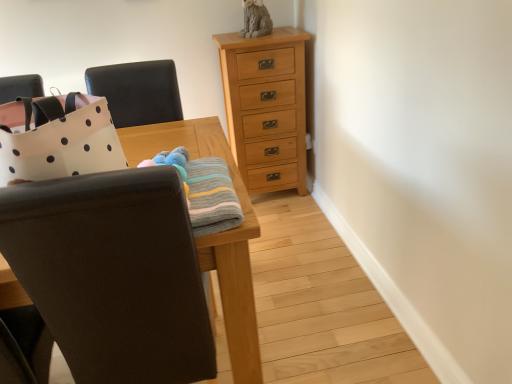
Measure the distance between point (x=151, y=273) and camera.

Point (x=151, y=273) and camera are 1.01 meters apart from each other.

What do you see at coordinates (113, 274) in the screenshot? This screenshot has width=512, height=384. I see `matte black chair at left, which is the first chair from bottom to top` at bounding box center [113, 274].

Consider the image. Measure the distance between black leather chair at upper left, which appears as the 1th chair when viewed from the top, and camera.

The depth of black leather chair at upper left, which appears as the 1th chair when viewed from the top, is 6.14 feet.

Describe the element at coordinates (266, 107) in the screenshot. This screenshot has width=512, height=384. I see `natural wood chest of drawers at upper center` at that location.

Identify the location of matte black chair at left, which is the first chair from bottom to top. Image resolution: width=512 pixels, height=384 pixels. (113, 274).

Is matte black chair at left, the 2th chair viewed from the top, looking in the opposite direction of black leather chair at upper left, which appears as the 1th chair when viewed from the top?

That's not correct — matte black chair at left, the 2th chair viewed from the top, is not looking away from black leather chair at upper left, which appears as the 1th chair when viewed from the top.

Image resolution: width=512 pixels, height=384 pixels. Identify the location of chair below the black leather chair at upper left, which appears as the 1th chair when viewed from the top (from the image's perspective). (113, 274).

Does matte black chair at left, the 2th chair viewed from the top, have a greater width compared to black leather chair at upper left, the 2th chair ordered from the bottom?

Indeed, matte black chair at left, the 2th chair viewed from the top, has a greater width compared to black leather chair at upper left, the 2th chair ordered from the bottom.

Is matte black chair at left, which is the first chair from bottom to top, closer to the viewer compared to black leather chair at upper left, which appears as the 1th chair when viewed from the top?

Yes, it is.

Is matte black chair at left, the 2th chair viewed from the top, bigger than knitted woolen blanket at center?

Correct, matte black chair at left, the 2th chair viewed from the top, is larger in size than knitted woolen blanket at center.

Is matte black chair at left, the 2th chair viewed from the top, facing away from knitted woolen blanket at center?

No, matte black chair at left, the 2th chair viewed from the top,'s orientation is not away from knitted woolen blanket at center.

From the image's perspective, is matte black chair at left, which is the first chair from bottom to top, under knitted woolen blanket at center?

Indeed, from the image's perspective, matte black chair at left, which is the first chair from bottom to top, is shown beneath knitted woolen blanket at center.

Image resolution: width=512 pixels, height=384 pixels. In order to click on blanket above the matte black chair at left, the 2th chair viewed from the top (from a real-world perspective) in this screenshot , I will do `click(212, 197)`.

Locate an element on the screen. The image size is (512, 384). chest of drawers above the black leather chair at upper left, the 2th chair ordered from the bottom (from the image's perspective) is located at coordinates (266, 107).

Would you say black leather chair at upper left, the 2th chair ordered from the bottom, is to the left or to the right of natural wood chest of drawers at upper center in the picture?

From the image, it's evident that black leather chair at upper left, the 2th chair ordered from the bottom, is to the left of natural wood chest of drawers at upper center.

From a real-world perspective, does black leather chair at upper left, which appears as the 1th chair when viewed from the top, sit lower than natural wood chest of drawers at upper center?

Incorrect, from a real-world perspective, black leather chair at upper left, which appears as the 1th chair when viewed from the top, is higher than natural wood chest of drawers at upper center.

Does black leather chair at upper left, the 2th chair ordered from the bottom, have a lesser height compared to natural wood chest of drawers at upper center?

Yes.

From a real-world perspective, who is located lower, natural wood chest of drawers at upper center or knitted woolen blanket at center?

natural wood chest of drawers at upper center, from a real-world perspective.

How different are the orientations of natural wood chest of drawers at upper center and knitted woolen blanket at center in degrees?

natural wood chest of drawers at upper center and knitted woolen blanket at center are facing 179 degrees away from each other.

Is point (254, 145) closer or farther from the camera than point (194, 212)?

Point (254, 145) is farther from the camera than point (194, 212).

Is natural wood chest of drawers at upper center outside of knitted woolen blanket at center?

Yes, natural wood chest of drawers at upper center is located beyond the bounds of knitted woolen blanket at center.

How many degrees apart are the facing directions of black leather chair at upper left, which appears as the 1th chair when viewed from the top, and matte black chair at left, the 2th chair viewed from the top?

The facing directions of black leather chair at upper left, which appears as the 1th chair when viewed from the top, and matte black chair at left, the 2th chair viewed from the top, are 178 degrees apart.

Which is less distant, (x=88, y=81) or (x=75, y=271)?

Point (x=88, y=81) is farther from the camera than point (x=75, y=271).

Which is correct: black leather chair at upper left, which appears as the 1th chair when viewed from the top, is inside matte black chair at left, which is the first chair from bottom to top, or outside of it?

black leather chair at upper left, which appears as the 1th chair when viewed from the top, cannot be found inside matte black chair at left, which is the first chair from bottom to top.

Which object is closer to the camera, black leather chair at upper left, the 2th chair ordered from the bottom, or matte black chair at left, the 2th chair viewed from the top?

matte black chair at left, the 2th chair viewed from the top, is more forward.

Does point (255, 58) lie in front of point (32, 216)?

That is False.

Are natural wood chest of drawers at upper center and matte black chair at left, the 2th chair viewed from the top, located far from each other?

Indeed, natural wood chest of drawers at upper center is not near matte black chair at left, the 2th chair viewed from the top.

Does natural wood chest of drawers at upper center appear on the left side of matte black chair at left, the 2th chair viewed from the top?

Incorrect, natural wood chest of drawers at upper center is not on the left side of matte black chair at left, the 2th chair viewed from the top.

In the image, there is a knitted woolen blanket at center. Where is `chair above it (from the image's perspective)`? This screenshot has height=384, width=512. chair above it (from the image's perspective) is located at coordinates (137, 92).

Between knitted woolen blanket at center and black leather chair at upper left, which appears as the 1th chair when viewed from the top, which one has smaller width?

black leather chair at upper left, which appears as the 1th chair when viewed from the top, is thinner.

From the image's perspective, relative to black leather chair at upper left, the 2th chair ordered from the bottom, is knitted woolen blanket at center above or below?

Based on their image positions, knitted woolen blanket at center is located beneath black leather chair at upper left, the 2th chair ordered from the bottom.

Considering the relative positions of knitted woolen blanket at center and black leather chair at upper left, which appears as the 1th chair when viewed from the top, in the image provided, is knitted woolen blanket at center to the right of black leather chair at upper left, which appears as the 1th chair when viewed from the top, from the viewer's perspective?

Yes, knitted woolen blanket at center is to the right of black leather chair at upper left, which appears as the 1th chair when viewed from the top.

I want to click on chair above the matte black chair at left, the 2th chair viewed from the top (from the image's perspective), so click(137, 92).

Identify the location of chair below the knitted woolen blanket at center (from a real-world perspective). Image resolution: width=512 pixels, height=384 pixels. (113, 274).

From the image, which object appears to be nearer to black leather chair at upper left, which appears as the 1th chair when viewed from the top, knitted woolen blanket at center or natural wood chest of drawers at upper center?

natural wood chest of drawers at upper center is closer to black leather chair at upper left, which appears as the 1th chair when viewed from the top.

When comparing their distances from black leather chair at upper left, the 2th chair ordered from the bottom, does natural wood chest of drawers at upper center or matte black chair at left, which is the first chair from bottom to top, seem closer?

Among the two, natural wood chest of drawers at upper center is located nearer to black leather chair at upper left, the 2th chair ordered from the bottom.

From the image, which object appears to be farther from knitted woolen blanket at center, black leather chair at upper left, which appears as the 1th chair when viewed from the top, or natural wood chest of drawers at upper center?

The object further to knitted woolen blanket at center is natural wood chest of drawers at upper center.

Looking at this image, from the image, which object appears to be nearer to matte black chair at left, the 2th chair viewed from the top, black leather chair at upper left, which appears as the 1th chair when viewed from the top, or natural wood chest of drawers at upper center?

Among the two, black leather chair at upper left, which appears as the 1th chair when viewed from the top, is located nearer to matte black chair at left, the 2th chair viewed from the top.

Looking at the image, which one is located further to natural wood chest of drawers at upper center, knitted woolen blanket at center or black leather chair at upper left, which appears as the 1th chair when viewed from the top?

The object further to natural wood chest of drawers at upper center is knitted woolen blanket at center.

When comparing their distances from knitted woolen blanket at center, does black leather chair at upper left, which appears as the 1th chair when viewed from the top, or matte black chair at left, the 2th chair viewed from the top, seem closer?

matte black chair at left, the 2th chair viewed from the top, lies closer to knitted woolen blanket at center than the other object.

When comparing their distances from matte black chair at left, the 2th chair viewed from the top, does knitted woolen blanket at center or black leather chair at upper left, the 2th chair ordered from the bottom, seem closer?

The object closer to matte black chair at left, the 2th chair viewed from the top, is knitted woolen blanket at center.

Estimate the real-world distances between objects in this image. Which object is further from natural wood chest of drawers at upper center, black leather chair at upper left, which appears as the 1th chair when viewed from the top, or matte black chair at left, which is the first chair from bottom to top?

Based on the image, matte black chair at left, which is the first chair from bottom to top, appears to be further to natural wood chest of drawers at upper center.

Where is `blanket between matte black chair at left, which is the first chair from bottom to top, and black leather chair at upper left, which appears as the 1th chair when viewed from the top, along the z-axis`? The height and width of the screenshot is (384, 512). blanket between matte black chair at left, which is the first chair from bottom to top, and black leather chair at upper left, which appears as the 1th chair when viewed from the top, along the z-axis is located at coordinates (212, 197).

Locate an element on the screen. The width and height of the screenshot is (512, 384). blanket positioned between matte black chair at left, the 2th chair viewed from the top, and natural wood chest of drawers at upper center from near to far is located at coordinates (212, 197).

Locate an element on the screen. chair located between knitted woolen blanket at center and natural wood chest of drawers at upper center in the depth direction is located at coordinates (137, 92).

Where is `chair between matte black chair at left, the 2th chair viewed from the top, and natural wood chest of drawers at upper center in the front-back direction`? The height and width of the screenshot is (384, 512). chair between matte black chair at left, the 2th chair viewed from the top, and natural wood chest of drawers at upper center in the front-back direction is located at coordinates (137, 92).